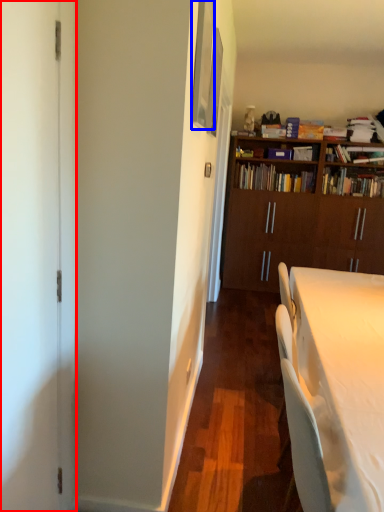
Question: Among these objects, which one is nearest to the camera, screen door (highlighted by a red box) or picture frame (highlighted by a blue box)?

Choices:
 (A) screen door
 (B) picture frame

Answer: (A)